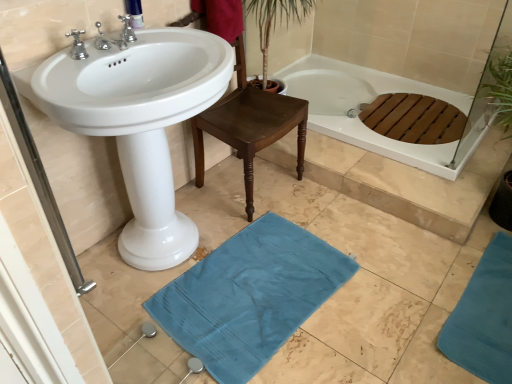
How much space does teal fabric bath mat at lower right, the second bath mat when ordered from left to right, occupy vertically?

1.55 inches.

Describe the element at coordinates (126, 31) in the screenshot. I see `polished chrome faucet at upper center, which appears as the second tap when viewed from the front` at that location.

What do you see at coordinates (221, 17) in the screenshot?
I see `blue cotton beach towel at upper center` at bounding box center [221, 17].

The width and height of the screenshot is (512, 384). Find the location of `blue fabric bath mat at lower center, the second bath mat viewed from the right`. blue fabric bath mat at lower center, the second bath mat viewed from the right is located at coordinates (249, 296).

Find the location of `bathtub behind the blue fabric bath mat at lower center, the second bath mat viewed from the right`. bathtub behind the blue fabric bath mat at lower center, the second bath mat viewed from the right is located at coordinates (369, 102).

Does blue fabric bath mat at lower center, the second bath mat viewed from the right, appear on the left side of white glossy bathtub at upper right?

Correct, you'll find blue fabric bath mat at lower center, the second bath mat viewed from the right, to the left of white glossy bathtub at upper right.

Between blue fabric bath mat at lower center, the 1th bath mat when ordered from left to right, and white glossy bathtub at upper right, which one has more height?

Standing taller between the two is white glossy bathtub at upper right.

Looking at this image, from the image's perspective, is blue fabric bath mat at lower center, the 1th bath mat when ordered from left to right, on top of white glossy bathtub at upper right?

No.

At what (x,y) coordinates should I click in order to perform the action: click on sink below the polished chrome faucet at upper center, which ranks as the first tap in back-to-front order (from a real-world perspective). Please return your answer as a coordinate pair (x, y). Looking at the image, I should click on (138, 122).

Considering the sizes of objects polished chrome faucet at upper center, which ranks as the first tap in back-to-front order, and white glossy sink at center in the image provided, who is taller, polished chrome faucet at upper center, which ranks as the first tap in back-to-front order, or white glossy sink at center?

With more height is white glossy sink at center.

What's the angular difference between polished chrome faucet at upper center, which ranks as the first tap in back-to-front order, and white glossy sink at center's facing directions?

polished chrome faucet at upper center, which ranks as the first tap in back-to-front order, and white glossy sink at center are facing 0.00148 degrees away from each other.

Between polished chrome faucet at upper center, which appears as the second tap when viewed from the front, and white glossy sink at center, which one has smaller width?

With smaller width is polished chrome faucet at upper center, which appears as the second tap when viewed from the front.

What's the angular difference between satin nickel faucet at upper left, the 2th tap positioned from the back, and blue fabric bath mat at lower center, the 1th bath mat when ordered from left to right,'s facing directions?

3.65 degrees.

Considering the sizes of objects satin nickel faucet at upper left, the 2th tap positioned from the back, and blue fabric bath mat at lower center, the second bath mat viewed from the right, in the image provided, who is bigger, satin nickel faucet at upper left, the 2th tap positioned from the back, or blue fabric bath mat at lower center, the second bath mat viewed from the right,?

blue fabric bath mat at lower center, the second bath mat viewed from the right.

Does satin nickel faucet at upper left, acting as the first tap starting from the front, come in front of blue fabric bath mat at lower center, the second bath mat viewed from the right?

Yes, the depth of satin nickel faucet at upper left, acting as the first tap starting from the front, is less than that of blue fabric bath mat at lower center, the second bath mat viewed from the right.

Considering the relative positions of polished chrome faucet at upper center, which ranks as the first tap in back-to-front order, and white glossy bathtub at upper right in the image provided, is polished chrome faucet at upper center, which ranks as the first tap in back-to-front order, to the left of white glossy bathtub at upper right from the viewer's perspective?

Correct, you'll find polished chrome faucet at upper center, which ranks as the first tap in back-to-front order, to the left of white glossy bathtub at upper right.

From the image's perspective, between polished chrome faucet at upper center, which ranks as the first tap in back-to-front order, and white glossy bathtub at upper right, who is located below?

white glossy bathtub at upper right, from the image's perspective.

Between polished chrome faucet at upper center, which appears as the second tap when viewed from the front, and white glossy bathtub at upper right, which one has less height?

With less height is white glossy bathtub at upper right.

Where is `bathtub beneath the polished chrome faucet at upper center, which ranks as the first tap in back-to-front order (from a real-world perspective)`? The image size is (512, 384). bathtub beneath the polished chrome faucet at upper center, which ranks as the first tap in back-to-front order (from a real-world perspective) is located at coordinates (369, 102).

From the image's perspective, would you say satin nickel faucet at upper left, the 2th tap positioned from the back, is shown under blue cotton beach towel at upper center?

Indeed, from the image's perspective, satin nickel faucet at upper left, the 2th tap positioned from the back, is shown beneath blue cotton beach towel at upper center.

Locate an element on the screen. tap that is the 1st one above the blue cotton beach towel at upper center (from a real-world perspective) is located at coordinates (116, 39).

In the scene shown: From a real-world perspective, is satin nickel faucet at upper left, the 2th tap positioned from the back, on top of blue cotton beach towel at upper center?

Yes, from a real-world perspective, satin nickel faucet at upper left, the 2th tap positioned from the back, is above blue cotton beach towel at upper center.

Considering the relative sizes of satin nickel faucet at upper left, acting as the first tap starting from the front, and blue cotton beach towel at upper center in the image provided, is satin nickel faucet at upper left, acting as the first tap starting from the front, wider than blue cotton beach towel at upper center?

Indeed, satin nickel faucet at upper left, acting as the first tap starting from the front, has a greater width compared to blue cotton beach towel at upper center.

Is teal fabric bath mat at lower right, which is the first bath mat from right to left, further to the viewer compared to white glossy bathtub at upper right?

That is False.

From a real-world perspective, is teal fabric bath mat at lower right, the second bath mat when ordered from left to right, above or below white glossy bathtub at upper right?

teal fabric bath mat at lower right, the second bath mat when ordered from left to right, is below white glossy bathtub at upper right.

Is teal fabric bath mat at lower right, the second bath mat when ordered from left to right, next to white glossy bathtub at upper right and touching it?

teal fabric bath mat at lower right, the second bath mat when ordered from left to right, and white glossy bathtub at upper right are clearly separated.

How many degrees apart are the facing directions of teal fabric bath mat at lower right, which is the first bath mat from right to left, and white glossy bathtub at upper right?

92.3 degrees separate the facing orientations of teal fabric bath mat at lower right, which is the first bath mat from right to left, and white glossy bathtub at upper right.

Can you confirm if white glossy bathtub at upper right is shorter than polished chrome faucet at upper center, which appears as the second tap when viewed from the front?

Yes, white glossy bathtub at upper right is shorter than polished chrome faucet at upper center, which appears as the second tap when viewed from the front.

From the image's perspective, is white glossy bathtub at upper right positioned above or below polished chrome faucet at upper center, which appears as the second tap when viewed from the front?

Clearly, from the image's perspective, white glossy bathtub at upper right is below polished chrome faucet at upper center, which appears as the second tap when viewed from the front.

Image resolution: width=512 pixels, height=384 pixels. I want to click on bathtub positioned vertically above the blue fabric bath mat at lower center, the second bath mat viewed from the right (from a real-world perspective), so click(369, 102).

You are a GUI agent. You are given a task and a screenshot of the screen. Output one action in this format:
    pyautogui.click(x=<x>, y=<y>)
    Task: Click on the sink on the right of polished chrome faucet at upper center, which appears as the second tap when viewed from the front
    
    Given the screenshot: What is the action you would take?
    pyautogui.click(x=138, y=122)

When comparing their distances from blue fabric bath mat at lower center, the 1th bath mat when ordered from left to right, does blue cotton beach towel at upper center or teal fabric bath mat at lower right, which is the first bath mat from right to left, seem closer?

Based on the image, teal fabric bath mat at lower right, which is the first bath mat from right to left, appears to be nearer to blue fabric bath mat at lower center, the 1th bath mat when ordered from left to right.

Which object lies nearer to the anchor point white glossy bathtub at upper right, white glossy sink at center or polished chrome faucet at upper center, which appears as the second tap when viewed from the front?

white glossy sink at center is closer to white glossy bathtub at upper right.

Which object lies nearer to the anchor point polished chrome faucet at upper center, which appears as the second tap when viewed from the front, teal fabric bath mat at lower right, which is the first bath mat from right to left, or white glossy bathtub at upper right?

The object closer to polished chrome faucet at upper center, which appears as the second tap when viewed from the front, is white glossy bathtub at upper right.

Considering their positions, is white glossy sink at center positioned further to satin nickel faucet at upper left, acting as the first tap starting from the front, than white glossy bathtub at upper right?

white glossy bathtub at upper right is further to satin nickel faucet at upper left, acting as the first tap starting from the front.

Which object lies further to the anchor point teal fabric bath mat at lower right, which is the first bath mat from right to left, blue fabric bath mat at lower center, the 1th bath mat when ordered from left to right, or white glossy sink at center?

The object further to teal fabric bath mat at lower right, which is the first bath mat from right to left, is white glossy sink at center.

Estimate the real-world distances between objects in this image. Which object is closer to teal fabric bath mat at lower right, the second bath mat when ordered from left to right, blue cotton beach towel at upper center or white glossy sink at center?

Among the two, white glossy sink at center is located nearer to teal fabric bath mat at lower right, the second bath mat when ordered from left to right.

Considering their positions, is blue fabric bath mat at lower center, the second bath mat viewed from the right, positioned closer to white glossy bathtub at upper right than blue cotton beach towel at upper center?

blue cotton beach towel at upper center is positioned closer to the anchor white glossy bathtub at upper right.

Estimate the real-world distances between objects in this image. Which object is closer to polished chrome faucet at upper center, which ranks as the first tap in back-to-front order, blue cotton beach towel at upper center or blue fabric bath mat at lower center, the 1th bath mat when ordered from left to right?

Among the two, blue cotton beach towel at upper center is located nearer to polished chrome faucet at upper center, which ranks as the first tap in back-to-front order.

I want to click on sink between polished chrome faucet at upper center, which ranks as the first tap in back-to-front order, and white glossy bathtub at upper right, so click(x=138, y=122).

The image size is (512, 384). I want to click on bath mat between satin nickel faucet at upper left, acting as the first tap starting from the front, and teal fabric bath mat at lower right, the second bath mat when ordered from left to right, from left to right, so click(x=249, y=296).

Locate an element on the screen. The height and width of the screenshot is (384, 512). tap between satin nickel faucet at upper left, acting as the first tap starting from the front, and teal fabric bath mat at lower right, which is the first bath mat from right to left, from left to right is located at coordinates (126, 31).

This screenshot has height=384, width=512. Identify the location of beach towel situated between satin nickel faucet at upper left, the 2th tap positioned from the back, and teal fabric bath mat at lower right, the second bath mat when ordered from left to right, from left to right. (221, 17).